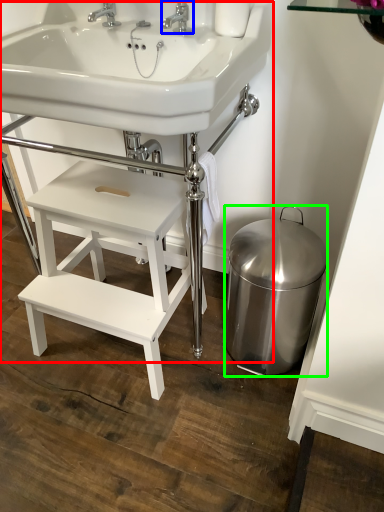
Question: Based on their relative distances, which object is nearer to sink (highlighted by a red box)? Choose from tap (highlighted by a blue box) and bidet (highlighted by a green box).

Choices:
 (A) tap
 (B) bidet

Answer: (A)